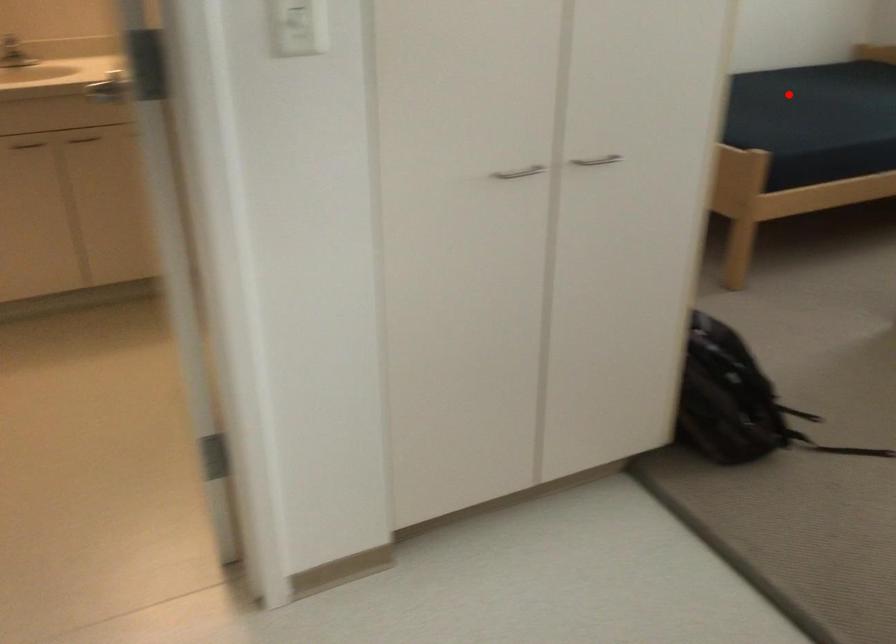
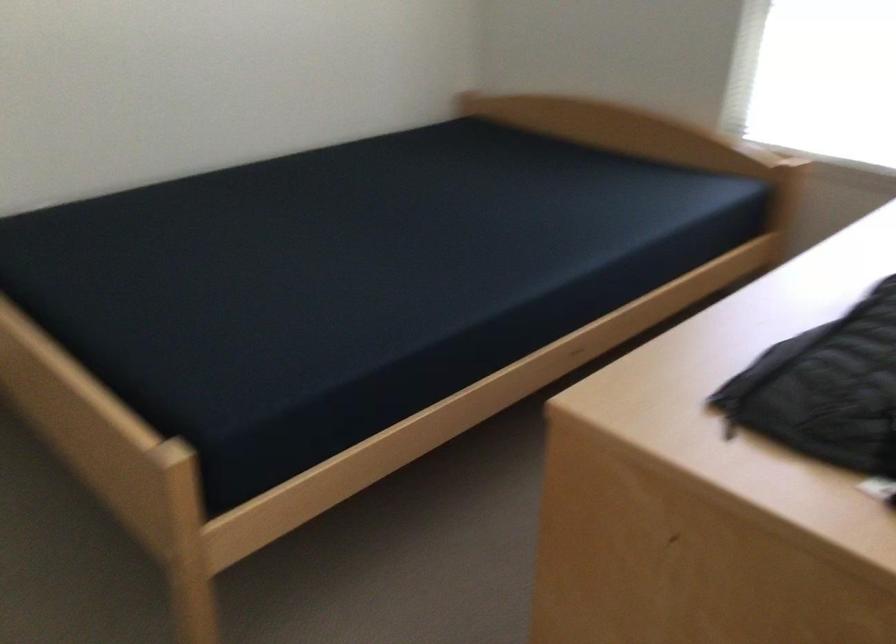
Question: I am providing you with two images of the same scene from different viewpoints. Image1 has a red point marked. In image2, the corresponding 3D location appears at what relative position? Reply with the corresponding letter.

Choices:
 (A) Closer
 (B) Farther

Answer: (A)